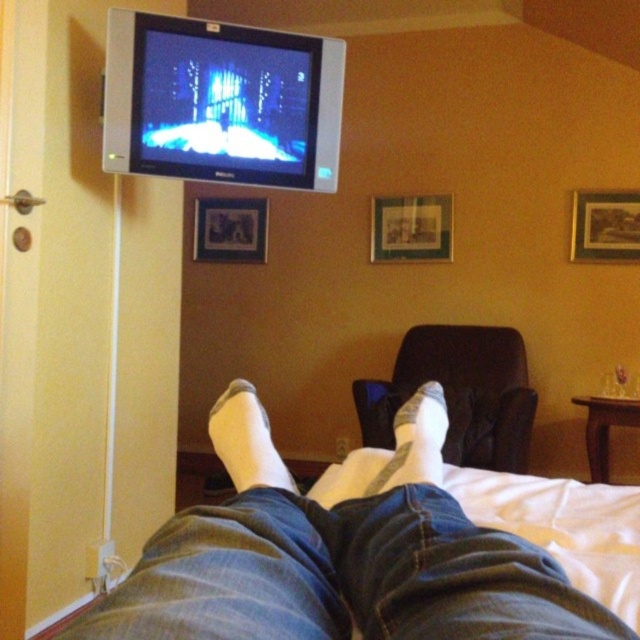
Looking at this image, does wooden picture frame at center appear on the left side of matte plastic picture frame at center?

No, wooden picture frame at center is not to the left of matte plastic picture frame at center.

Who is higher up, wooden picture frame at center or matte plastic picture frame at center?

matte plastic picture frame at center is above.

Is point (400, 208) farther from viewer compared to point (253, 230)?

No, it is not.

At what (x,y) coordinates should I click in order to perform the action: click on wooden picture frame at center. Please return your answer as a coordinate pair (x, y). Looking at the image, I should click on tap(412, 228).

Is brown leather armchair at lower center above white soft sock at lower center?

No.

Is brown leather armchair at lower center below white soft sock at lower center?

Yes.

Between point (378, 380) and point (401, 467), which one is positioned behind?

Positioned behind is point (378, 380).

Locate an element on the screen. The width and height of the screenshot is (640, 640). brown leather armchair at lower center is located at coordinates (458, 394).

Is white socks at lower center below wooden picture frame at center?

Indeed, white socks at lower center is positioned under wooden picture frame at center.

Who is lower down, white socks at lower center or wooden picture frame at center?

Positioned lower is white socks at lower center.

Is point (502, 604) in front of point (419, 248)?

Yes, it is in front of point (419, 248).

Locate an element on the screen. The height and width of the screenshot is (640, 640). white socks at lower center is located at coordinates [x=333, y=563].